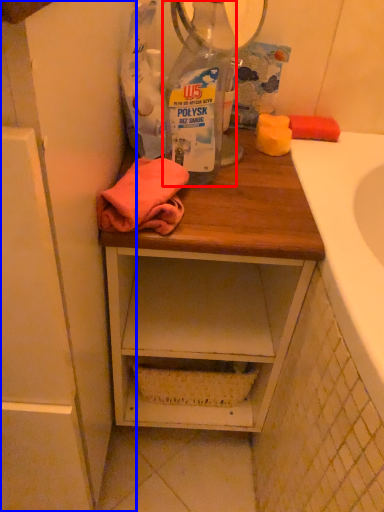
Question: Which object appears closest to the camera in this image, bottle (highlighted by a red box) or cabinetry (highlighted by a blue box)?

Choices:
 (A) bottle
 (B) cabinetry

Answer: (B)